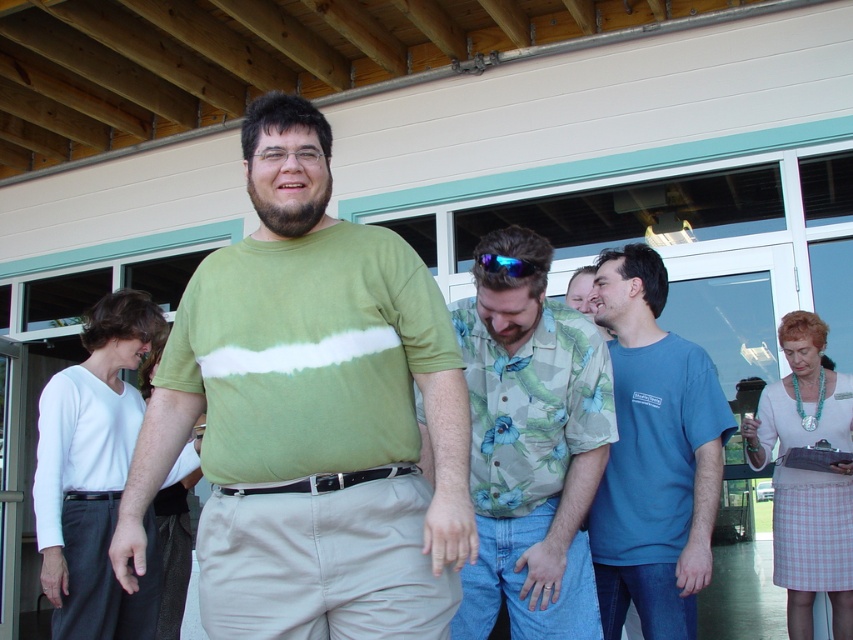
Question: Is khaki pants at lower right wider than blue reflective lens at center?

Choices:
 (A) no
 (B) yes

Answer: (B)

Question: Can you confirm if floral print shirt at center is smaller than blue reflective lens at center?

Choices:
 (A) yes
 (B) no

Answer: (B)

Question: Which point is closer to the camera?

Choices:
 (A) (502, 264)
 (B) (808, 317)
 (C) (431, 460)
 (D) (601, 593)

Answer: (A)

Question: Is the position of khaki pants at lower right more distant than that of blue reflective lens at center?

Choices:
 (A) no
 (B) yes

Answer: (B)

Question: Which object is positioned farthest from the floral print shirt at center?

Choices:
 (A) khaki pants at lower right
 (B) blue reflective lens at center
 (C) white matte shirt at left

Answer: (A)

Question: Which of the following is the farthest from the observer?

Choices:
 (A) (514, 378)
 (B) (775, 420)

Answer: (B)